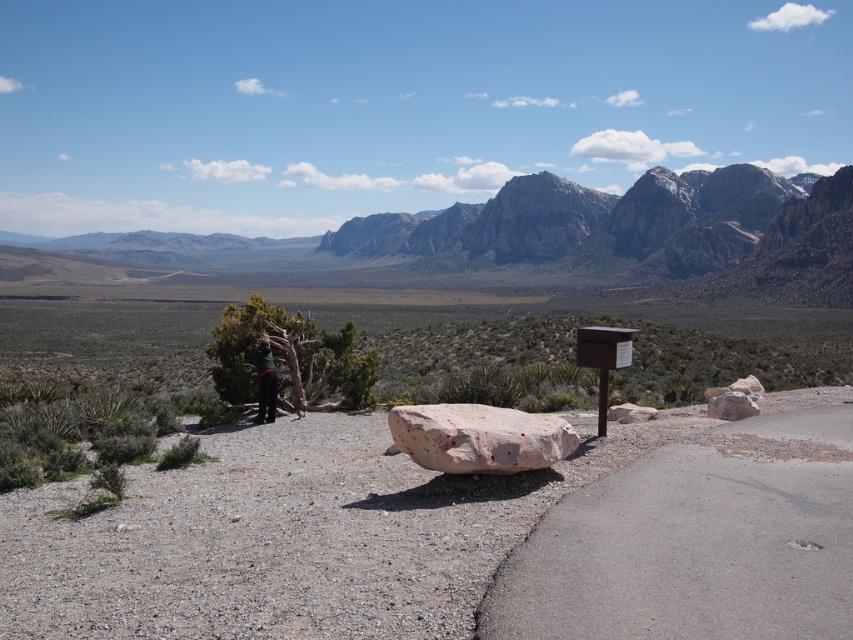
Is point (264, 371) closer to camera compared to point (732, 406)?

No, (264, 371) is behind (732, 406).

Which is behind, point (259, 406) or point (706, 406)?

Point (259, 406)

The image size is (853, 640). What do you see at coordinates (263, 380) in the screenshot?
I see `dark green fabric at center` at bounding box center [263, 380].

This screenshot has height=640, width=853. What are the coordinates of `dark green fabric at center` in the screenshot? It's located at click(x=263, y=380).

Between point (535, 438) and point (245, 355), which one is positioned behind?

The point (245, 355) is more distant.

Who is shorter, pink polished rock at center or dark green fabric at center?

With less height is pink polished rock at center.

The height and width of the screenshot is (640, 853). What are the coordinates of `pink polished rock at center` in the screenshot? It's located at (479, 436).

Is pink polished rock at center thinner than rusty stone boulder at right?

In fact, pink polished rock at center might be wider than rusty stone boulder at right.

Can you confirm if pink polished rock at center is positioned above rusty stone boulder at right?

Indeed, pink polished rock at center is positioned over rusty stone boulder at right.

Which is in front, point (469, 417) or point (712, 403)?

Point (469, 417) is in front.

What are the coordinates of `pink polished rock at center` in the screenshot? It's located at (479, 436).